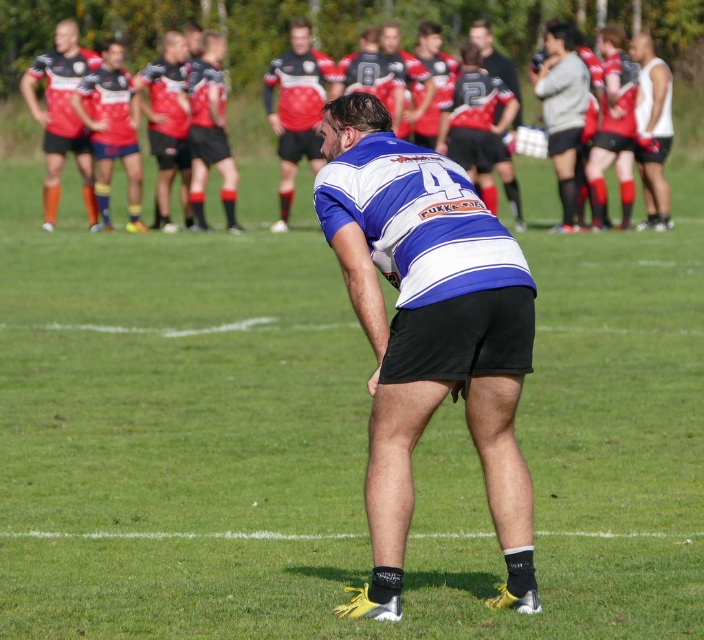
Question: Which point is farther from the camera taking this photo?

Choices:
 (A) (446, 77)
 (B) (80, 147)

Answer: (A)

Question: Does matte red rugby jersey at upper left have a smaller size compared to white matte singlet at right?

Choices:
 (A) no
 (B) yes

Answer: (B)

Question: Which point is closer to the camera taking this photo?

Choices:
 (A) (396, 72)
 (B) (314, 125)

Answer: (B)

Question: Observing the image, what is the correct spatial positioning of matte red and black rugby jersey at upper center in reference to matte blue jersey at center?

Choices:
 (A) below
 (B) above

Answer: (A)

Question: Is matte red and black rugby jersey at upper center bigger than matte black shorts at upper right?

Choices:
 (A) no
 (B) yes

Answer: (B)

Question: Which point is farther to the camera?

Choices:
 (A) matte red and black rugby jersey at upper center
 (B) matte blue jersey at center

Answer: (B)